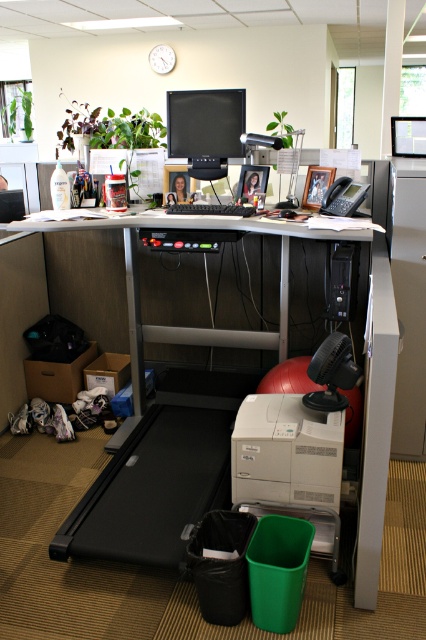
Looking at this image, does white plastic file cabinet at right have a lesser width compared to matte black monitor at upper center?

Yes, white plastic file cabinet at right is thinner than matte black monitor at upper center.

This screenshot has height=640, width=426. I want to click on white plastic file cabinet at right, so click(405, 291).

Does matte gray printer at lower center appear over white plastic file cabinet at right?

No, matte gray printer at lower center is not above white plastic file cabinet at right.

This screenshot has height=640, width=426. What do you see at coordinates (290, 464) in the screenshot?
I see `matte gray printer at lower center` at bounding box center [290, 464].

Locate an element on the screen. This screenshot has height=640, width=426. matte gray printer at lower center is located at coordinates (290, 464).

Is matte black monitor at upper center thinner than matte black telephone at right?

No, matte black monitor at upper center is not thinner than matte black telephone at right.

Who is positioned more to the left, matte black monitor at upper center or matte black telephone at right?

From the viewer's perspective, matte black monitor at upper center appears more on the left side.

Where is `matte black monitor at upper center`? Image resolution: width=426 pixels, height=640 pixels. matte black monitor at upper center is located at coordinates (206, 128).

Locate an element on the screen. The height and width of the screenshot is (640, 426). matte black monitor at upper center is located at coordinates (206, 128).